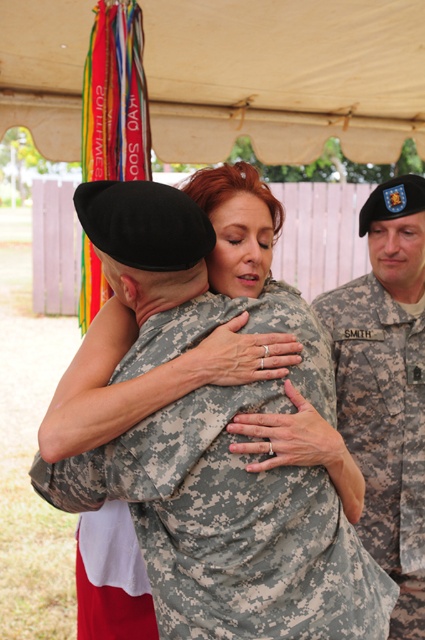
Question: Based on their relative distances, which object is nearer to the camouflage fabric uniform at center?

Choices:
 (A) camouflage uniform at center
 (B) white fabric canopy at upper center

Answer: (A)

Question: Which is nearer to the camouflage uniform at center?

Choices:
 (A) camouflage fabric uniform at center
 (B) white fabric canopy at upper center

Answer: (A)

Question: Is camouflage fabric uniform at center wider than white fabric canopy at upper center?

Choices:
 (A) no
 (B) yes

Answer: (A)

Question: Can you confirm if camouflage fabric uniform at center is positioned to the right of camouflage uniform at center?

Choices:
 (A) yes
 (B) no

Answer: (B)

Question: Is camouflage fabric uniform at center thinner than white fabric canopy at upper center?

Choices:
 (A) yes
 (B) no

Answer: (A)

Question: Based on their relative distances, which object is farther from the white fabric canopy at upper center?

Choices:
 (A) camouflage uniform at center
 (B) camouflage fabric uniform at center

Answer: (A)